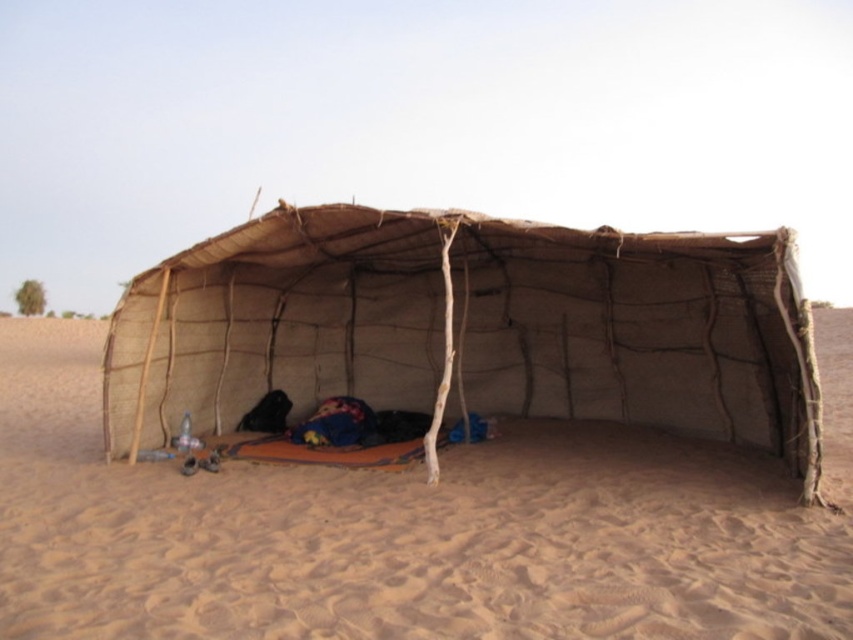
The width and height of the screenshot is (853, 640). What are the coordinates of `brown sandy ground at center` in the screenshot? It's located at (410, 529).

Who is positioned more to the right, brown sandy ground at center or natural woven fabric tent at center?

Positioned to the right is brown sandy ground at center.

Where is `brown sandy ground at center`? The width and height of the screenshot is (853, 640). brown sandy ground at center is located at coordinates (410, 529).